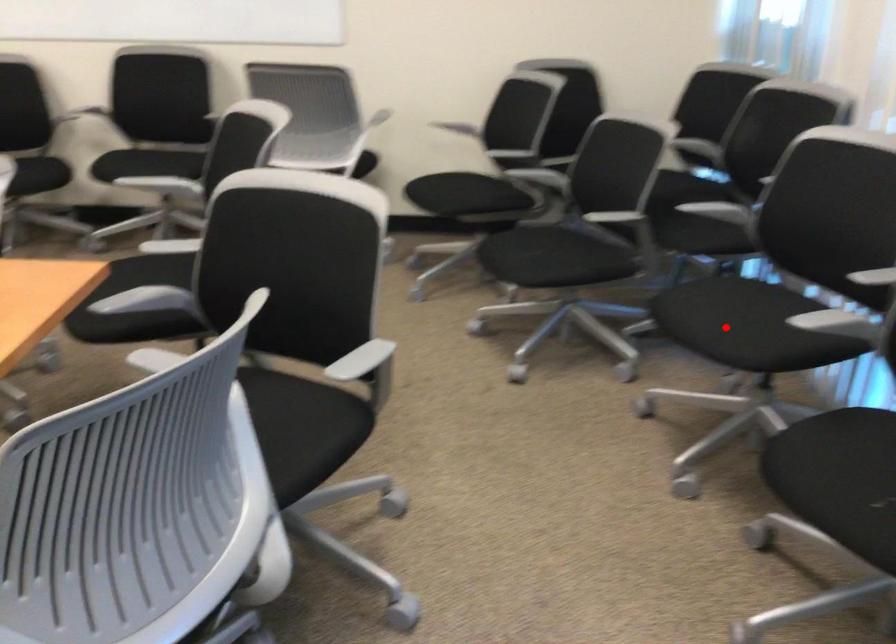
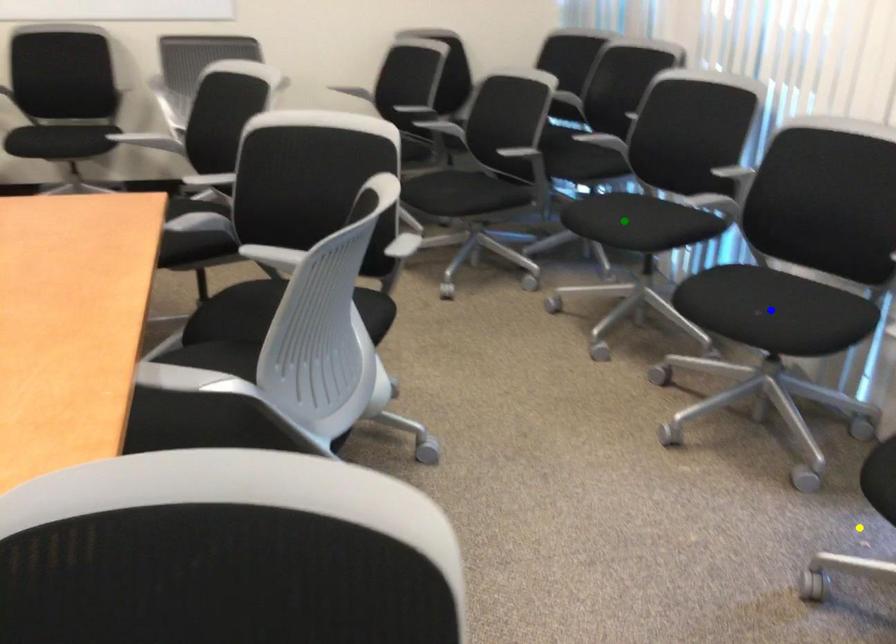
Question: I am providing you with two images of the same scene from different viewpoints. A red point is marked on the first image. You are given multiple points on the second image. Can you choose the point in image 2 that corresponds to the point in image 1?

Choices:
 (A) yellow point
 (B) blue point
 (C) green point

Answer: (C)